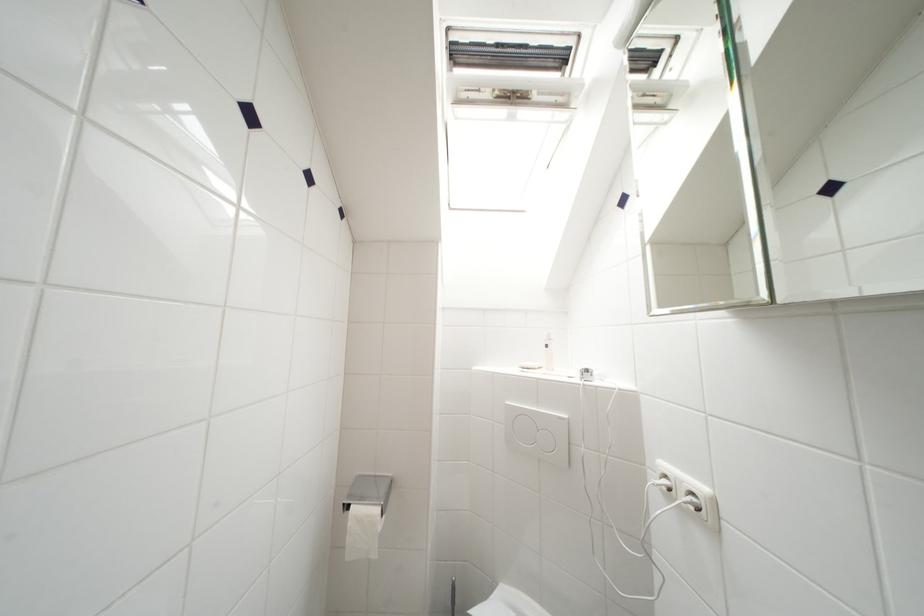
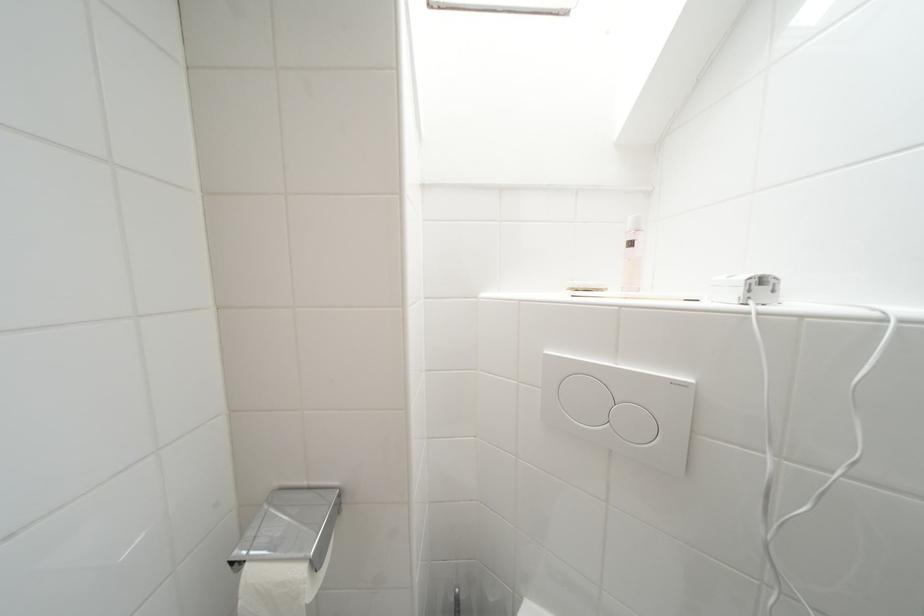
Find the pixel in the second image that matches (x=382, y=480) in the first image.

(315, 491)